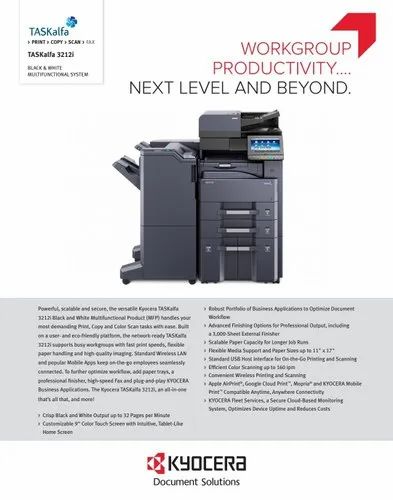
Where is `caster`? caster is located at coordinates coord(126,279), coord(191,280).